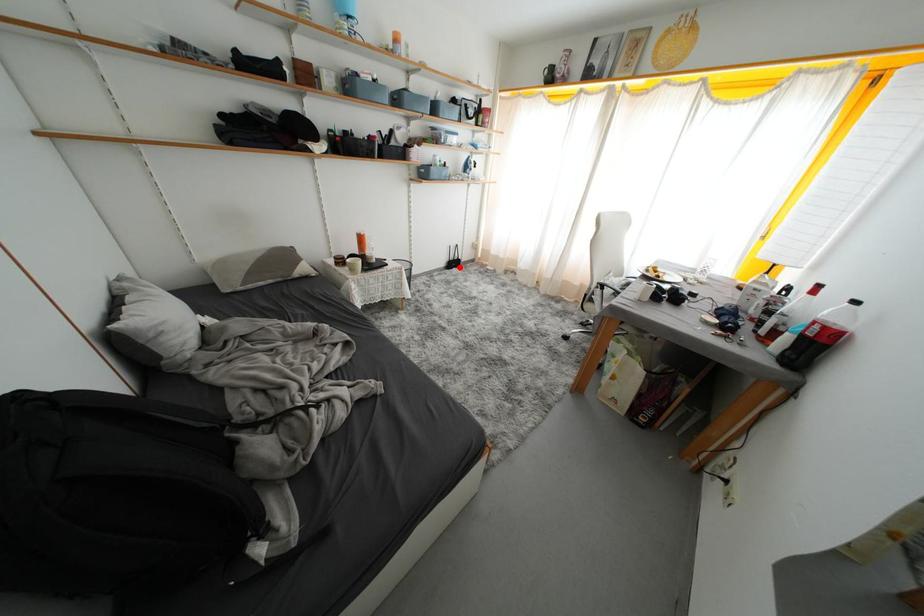
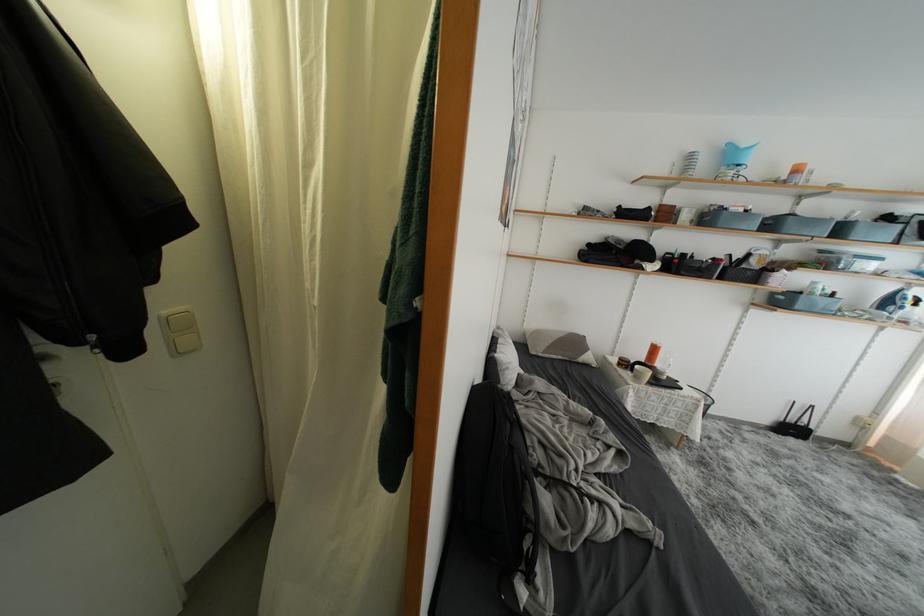
Question: I am providing you with two images of the same scene from different viewpoints. In image1, a red point is highlighted. Considering the same 3D point in image2, which of the following is correct?

Choices:
 (A) It is closer
 (B) It is farther

Answer: (A)